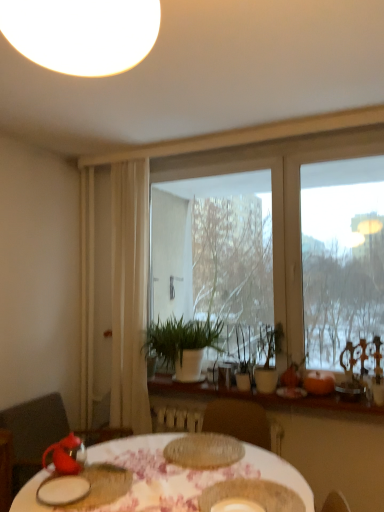
The width and height of the screenshot is (384, 512). Identify the location of free space between matte brown plate at center, the 5th tableware viewed from the left, and matte red teapot at lower left, which is the 10th tableware in right-to-left order. (140, 490).